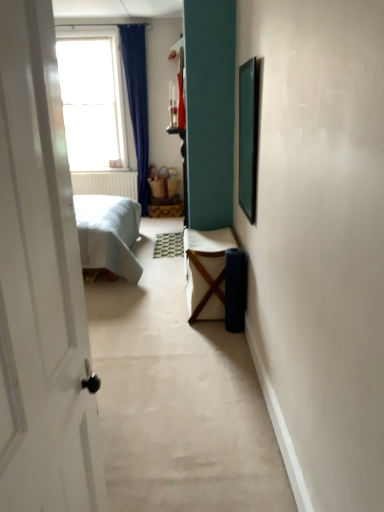
Question: From the image's perspective, is transparent glass window at upper left above green matte picture frame at upper right?

Choices:
 (A) yes
 (B) no

Answer: (A)

Question: Considering the relative sizes of transparent glass window at upper left and green matte picture frame at upper right in the image provided, is transparent glass window at upper left taller than green matte picture frame at upper right?

Choices:
 (A) no
 (B) yes

Answer: (B)

Question: Is transparent glass window at upper left positioned beyond the bounds of green matte picture frame at upper right?

Choices:
 (A) no
 (B) yes

Answer: (B)

Question: Is transparent glass window at upper left not close to green matte picture frame at upper right?

Choices:
 (A) yes
 (B) no

Answer: (A)

Question: Are transparent glass window at upper left and green matte picture frame at upper right beside each other?

Choices:
 (A) yes
 (B) no

Answer: (B)

Question: From a real-world perspective, does transparent glass window at upper left sit lower than green matte picture frame at upper right?

Choices:
 (A) no
 (B) yes

Answer: (A)

Question: Is the position of white fabric chair at center less distant than that of green matte picture frame at upper right?

Choices:
 (A) yes
 (B) no

Answer: (B)

Question: From the image's perspective, is white fabric chair at center below green matte picture frame at upper right?

Choices:
 (A) no
 (B) yes

Answer: (B)

Question: Is white fabric chair at center shorter than green matte picture frame at upper right?

Choices:
 (A) yes
 (B) no

Answer: (A)

Question: Considering the relative sizes of white fabric chair at center and green matte picture frame at upper right in the image provided, is white fabric chair at center bigger than green matte picture frame at upper right?

Choices:
 (A) no
 (B) yes

Answer: (B)

Question: From a real-world perspective, does white fabric chair at center stand above green matte picture frame at upper right?

Choices:
 (A) yes
 (B) no

Answer: (B)

Question: Does white fabric chair at center lie behind green matte picture frame at upper right?

Choices:
 (A) no
 (B) yes

Answer: (B)

Question: Can you confirm if green matte picture frame at upper right is positioned to the right of white fabric chair at center?

Choices:
 (A) yes
 (B) no

Answer: (A)